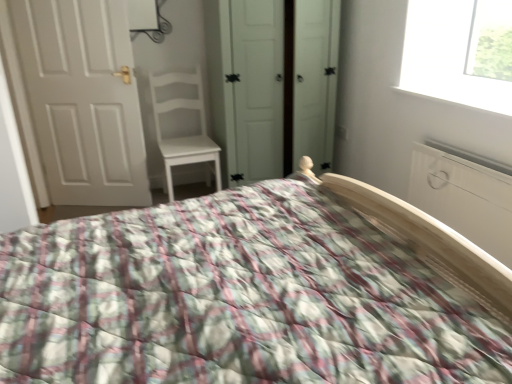
This screenshot has width=512, height=384. Describe the element at coordinates (182, 126) in the screenshot. I see `white matte chair at center` at that location.

The image size is (512, 384). Describe the element at coordinates (236, 299) in the screenshot. I see `fluffy quilted bed at center` at that location.

At what (x,y) coordinates should I click in order to perform the action: click on white matte radiator at right. Please return your answer as a coordinate pair (x, y). Looking at the image, I should click on (464, 198).

This screenshot has width=512, height=384. What do you see at coordinates (464, 198) in the screenshot? I see `white matte radiator at right` at bounding box center [464, 198].

The width and height of the screenshot is (512, 384). In order to click on white matte chair at center in this screenshot , I will do click(x=182, y=126).

Is white matte chair at center taller than white matte door at left?

No, white matte chair at center is not taller than white matte door at left.

Is white matte chair at center aimed at white matte door at left?

No, white matte chair at center is not facing towards white matte door at left.

From a real-world perspective, does white matte chair at center stand above white matte door at left?

Actually, white matte chair at center is physically below white matte door at left in the real world.

How distant is white matte chair at center from white matte door at left?

The distance of white matte chair at center from white matte door at left is 21.57 inches.

Is white matte wardrobe at center surrounding white matte door at left?

Actually, white matte door at left is outside white matte wardrobe at center.

From the image's perspective, is white matte wardrobe at center positioned above or below white matte door at left?

white matte wardrobe at center is situated higher than white matte door at left in the image.

From the picture: Is white matte wardrobe at center thinner than white matte door at left?

No.

Is white matte wardrobe at center bigger than white matte door at left?

Yes.

Considering the positions of objects white matte radiator at right and fluffy quilted bed at center in the image provided, who is in front, white matte radiator at right or fluffy quilted bed at center?

Positioned in front is fluffy quilted bed at center.

Based on the photo, is white matte radiator at right far from fluffy quilted bed at center?

Absolutely, white matte radiator at right is distant from fluffy quilted bed at center.

From the image's perspective, which is above, white matte radiator at right or fluffy quilted bed at center?

white matte radiator at right appears higher in the image.

Locate an element on the screen. Image resolution: width=512 pixels, height=384 pixels. armoire beneath the white matte chair at center (from a real-world perspective) is located at coordinates (464, 198).

Does white matte chair at center turn towards white matte radiator at right?

No.

Between white matte chair at center and white matte radiator at right, which one has smaller width?

Thinner between the two is white matte radiator at right.

Which of these two, white matte chair at center or white matte radiator at right, stands taller?

white matte chair at center is taller.

Looking at this image, considering the relative sizes of white matte door at left and white matte chair at center in the image provided, is white matte door at left smaller than white matte chair at center?

Correct, white matte door at left occupies less space than white matte chair at center.

From the image's perspective, would you say white matte door at left is shown under white matte chair at center?

No.

Considering the relative sizes of white matte door at left and white matte chair at center in the image provided, is white matte door at left shorter than white matte chair at center?

Incorrect, the height of white matte door at left does not fall short of that of white matte chair at center.

Does white matte door at left touch white matte chair at center?

white matte door at left and white matte chair at center are not in contact.

Is fluffy quilted bed at center oriented away from white matte wardrobe at center?

No, fluffy quilted bed at center is not facing away from white matte wardrobe at center.

Considering the sizes of fluffy quilted bed at center and white matte wardrobe at center in the image, is fluffy quilted bed at center wider or thinner than white matte wardrobe at center?

Clearly, fluffy quilted bed at center has more width compared to white matte wardrobe at center.

Is there a large distance between fluffy quilted bed at center and white matte wardrobe at center?

fluffy quilted bed at center is positioned a significant distance from white matte wardrobe at center.

Which object is further away from the camera, fluffy quilted bed at center or white matte wardrobe at center?

white matte wardrobe at center is more distant.

Which is more to the left, white matte radiator at right or white matte chair at center?

Positioned to the left is white matte chair at center.

Would you say white matte radiator at right is outside white matte chair at center?

white matte radiator at right is positioned outside white matte chair at center.

Is white matte radiator at right facing away from white matte chair at center?

No, white matte radiator at right is not facing away from white matte chair at center.

Where is `chair located above the white matte radiator at right (from a real-world perspective)`? chair located above the white matte radiator at right (from a real-world perspective) is located at coordinates (182, 126).

The width and height of the screenshot is (512, 384). In order to click on door in front of the white matte chair at center in this screenshot , I will do `click(83, 99)`.

In the image, there is a white matte wardrobe at center. Identify the location of door below it (from the image's perspective). The width and height of the screenshot is (512, 384). (83, 99).

Looking at the image, which one is located further to white matte door at left, white matte wardrobe at center or white matte chair at center?

Among the two, white matte wardrobe at center is located further to white matte door at left.

Based on their spatial positions, is white matte radiator at right or white matte chair at center closer to white matte door at left?

Based on the image, white matte chair at center appears to be nearer to white matte door at left.

Based on their spatial positions, is white matte radiator at right or white matte door at left closer to white matte wardrobe at center?

white matte door at left.

Estimate the real-world distances between objects in this image. Which object is further from white matte chair at center, fluffy quilted bed at center or white matte wardrobe at center?

fluffy quilted bed at center is positioned further to the anchor white matte chair at center.

Looking at the image, which one is located further to white matte radiator at right, white matte chair at center or white matte wardrobe at center?

The object further to white matte radiator at right is white matte chair at center.

Considering their positions, is white matte door at left positioned closer to white matte wardrobe at center than fluffy quilted bed at center?

Based on the image, white matte door at left appears to be nearer to white matte wardrobe at center.

From the image, which object appears to be nearer to white matte door at left, white matte chair at center or white matte wardrobe at center?

Among the two, white matte chair at center is located nearer to white matte door at left.

Estimate the real-world distances between objects in this image. Which object is closer to white matte radiator at right, white matte wardrobe at center or fluffy quilted bed at center?

fluffy quilted bed at center is positioned closer to the anchor white matte radiator at right.

Identify the location of door between fluffy quilted bed at center and white matte chair at center along the z-axis. (83, 99).

Locate an element on the screen. This screenshot has width=512, height=384. chair between white matte door at left and white matte wardrobe at center is located at coordinates (182, 126).

This screenshot has height=384, width=512. I want to click on screen door between white matte door at left and white matte radiator at right in the horizontal direction, so click(x=255, y=85).

The image size is (512, 384). What are the coordinates of `armoire located between fluffy quilted bed at center and white matte door at left in the depth direction` in the screenshot? It's located at (464, 198).